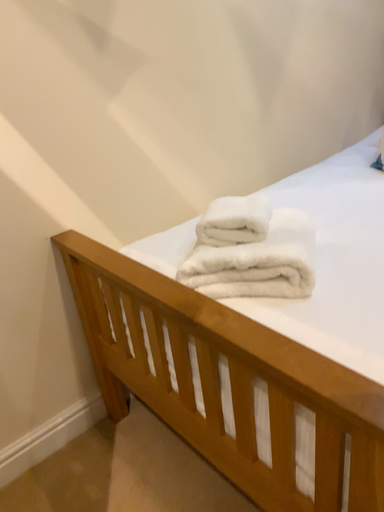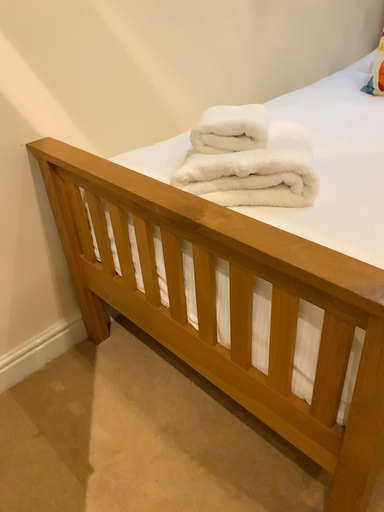
Question: How did the camera likely rotate when shooting the video?

Choices:
 (A) rotated downward
 (B) rotated upward

Answer: (A)